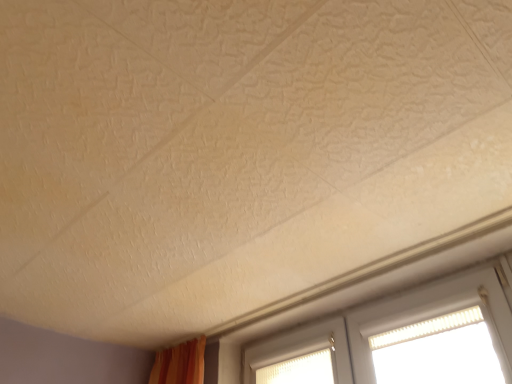
Describe the element at coordinates (301, 356) in the screenshot. I see `white plastic screen door at lower right` at that location.

Identify the location of white plastic screen door at lower right. (301, 356).

At what (x,y) coordinates should I click in order to perform the action: click on white plastic screen door at lower right. Please return your answer as a coordinate pair (x, y). Looking at the image, I should click on (301, 356).